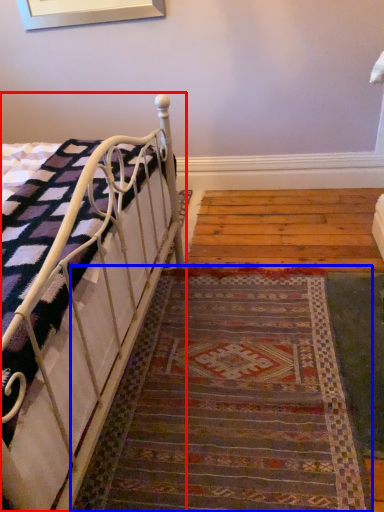
Question: Among these objects, which one is nearest to the camera, bed (highlighted by a red box) or doormat (highlighted by a blue box)?

Choices:
 (A) bed
 (B) doormat

Answer: (A)